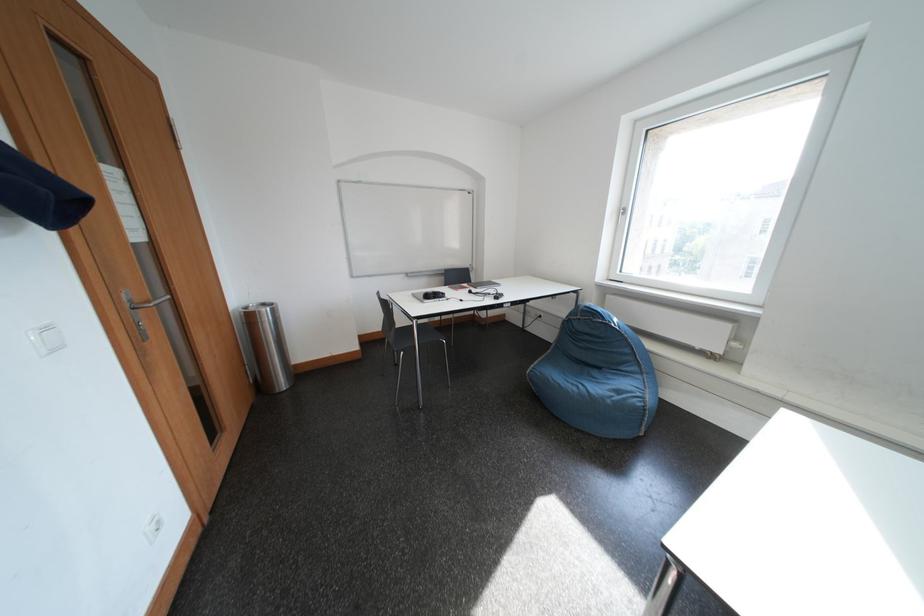
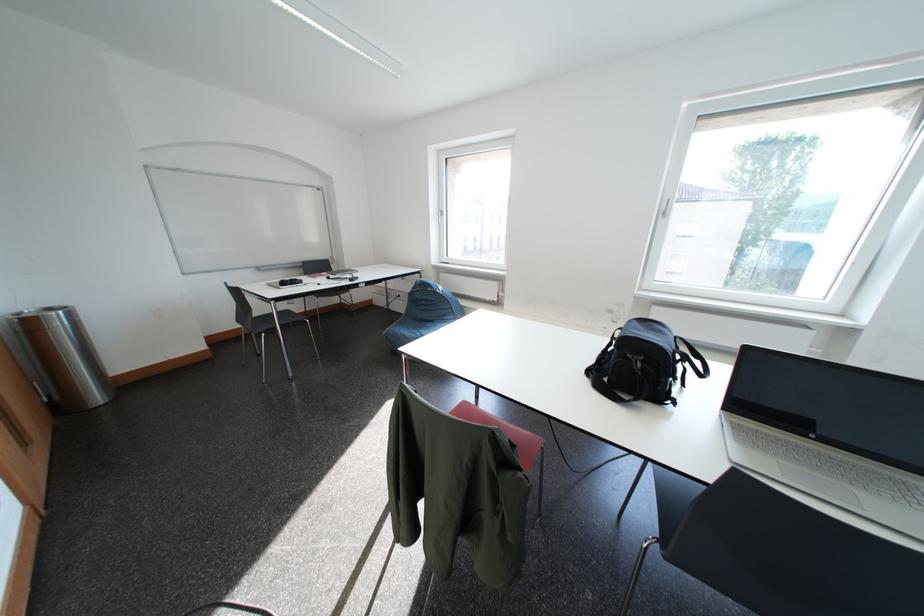
Find the pixel in the second image that matches (x=274, y=307) in the first image.

(59, 312)